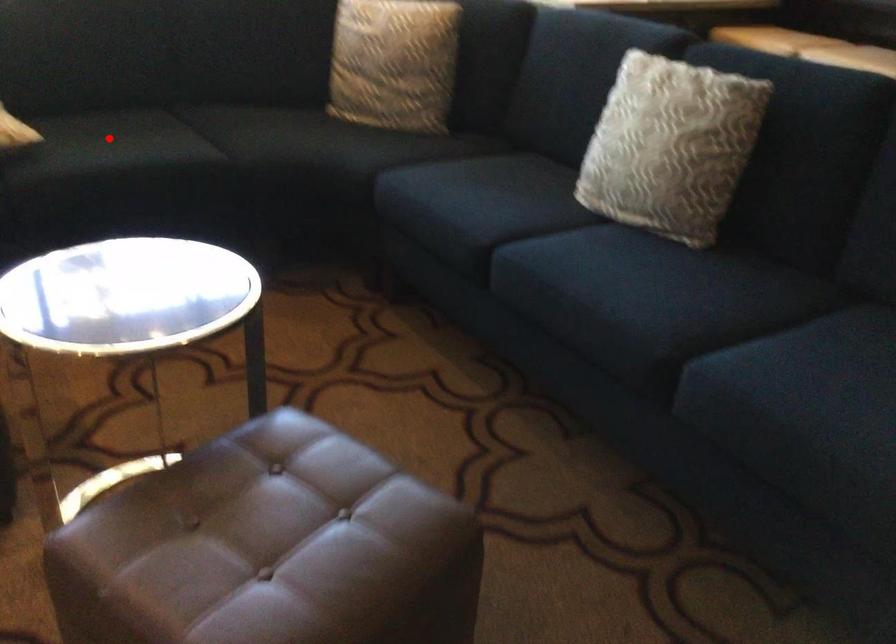
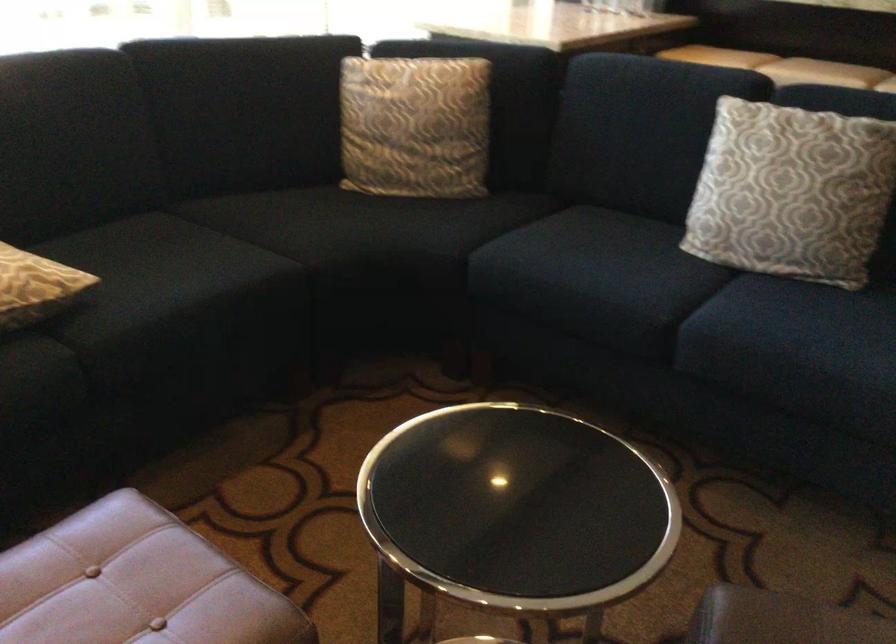
Find the pixel in the second image that matches the highlighted location in the first image.

(161, 270)